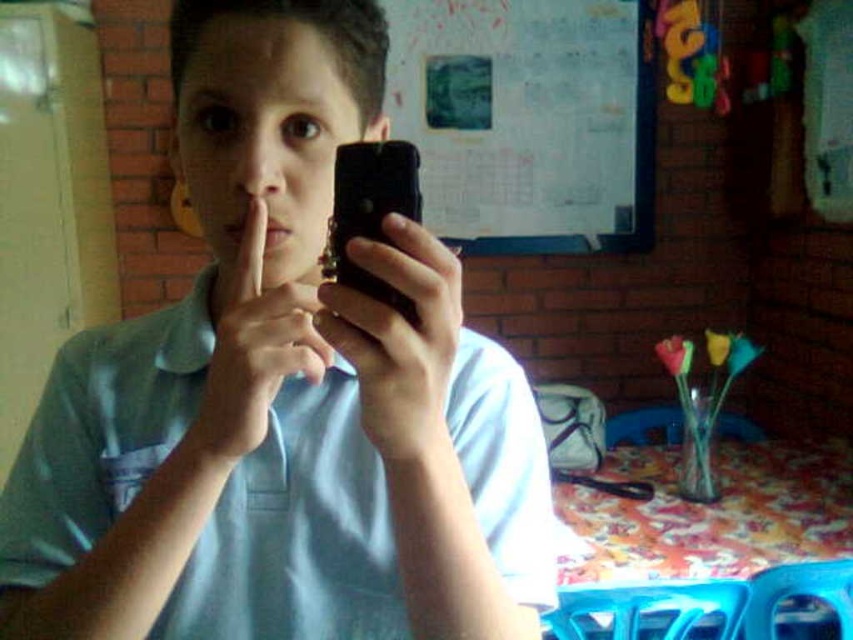
Can you confirm if white paper at upper center is wider than matte skin at center?

Yes.

Is white paper at upper center to the right of matte skin at center from the viewer's perspective?

Yes, white paper at upper center is to the right of matte skin at center.

This screenshot has width=853, height=640. Find the location of `white paper at upper center`. white paper at upper center is located at coordinates (527, 120).

Find the location of a particular element. This screenshot has height=640, width=853. white paper at upper center is located at coordinates 527,120.

Where is `white paper at upper center`? white paper at upper center is located at coordinates (527, 120).

Who is taller, white paper at upper center or matte black phone at center?

white paper at upper center

This screenshot has width=853, height=640. In order to click on white paper at upper center in this screenshot , I will do `click(527, 120)`.

Consider the image. Between matte blue shirt at center and matte skin at center, which one has less height?

matte skin at center is shorter.

Is matte blue shirt at center shorter than matte skin at center?

In fact, matte blue shirt at center may be taller than matte skin at center.

Between point (308, 371) and point (225, 346), which one is positioned in front?

Point (308, 371) is more forward.

The width and height of the screenshot is (853, 640). Find the location of `matte blue shirt at center`. matte blue shirt at center is located at coordinates (281, 396).